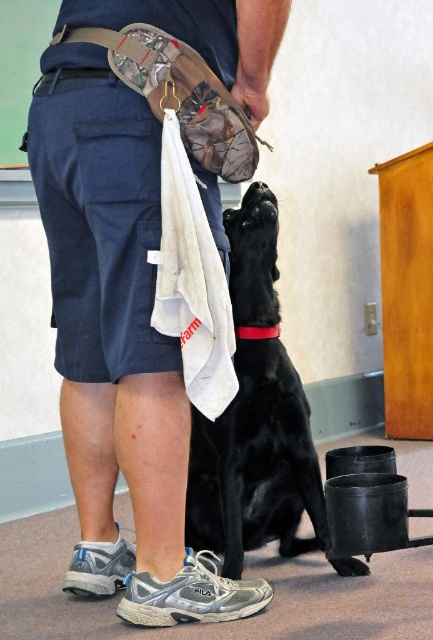
Consider the image. Is black smooth dog at center taller than green matte bulletin board at upper left?

Yes, black smooth dog at center is taller than green matte bulletin board at upper left.

In the scene shown: Does black smooth dog at center have a lesser width compared to green matte bulletin board at upper left?

In fact, black smooth dog at center might be wider than green matte bulletin board at upper left.

Is point (229, 538) closer to viewer compared to point (38, 33)?

Yes.

The image size is (433, 640). I want to click on black smooth dog at center, so click(255, 417).